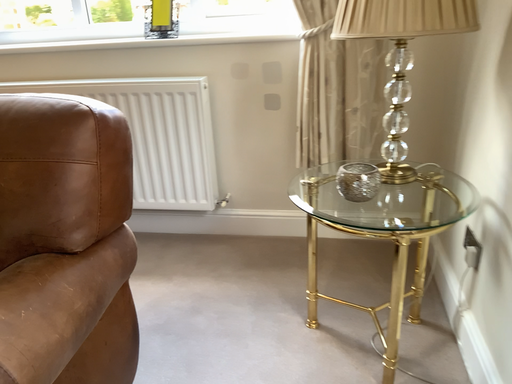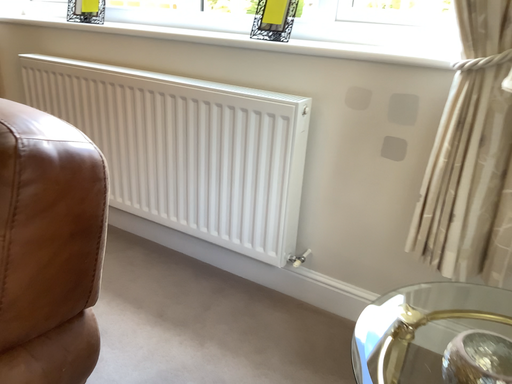
Question: Which way did the camera rotate in the video?

Choices:
 (A) rotated right
 (B) rotated left

Answer: (B)